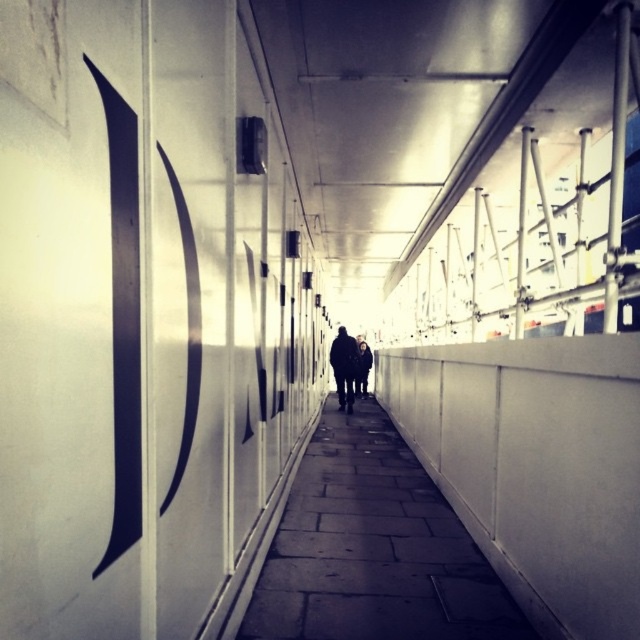
Question: Does dark wool coat at center have a smaller size compared to dark gray jacket at center?

Choices:
 (A) no
 (B) yes

Answer: (B)

Question: Which of these objects is positioned farthest from the dark wool coat at center?

Choices:
 (A) dark gray stone pavement at center
 (B) dark gray jacket at center

Answer: (A)

Question: Does dark gray stone pavement at center have a smaller size compared to dark wool coat at center?

Choices:
 (A) no
 (B) yes

Answer: (B)

Question: Is the position of dark gray stone pavement at center more distant than that of dark gray jacket at center?

Choices:
 (A) yes
 (B) no

Answer: (B)

Question: Which point is closer to the camera?

Choices:
 (A) dark gray stone pavement at center
 (B) dark wool coat at center
 (C) dark gray jacket at center

Answer: (A)

Question: Which point is farther from the camera taking this photo?

Choices:
 (A) (308, 618)
 (B) (339, 352)

Answer: (B)